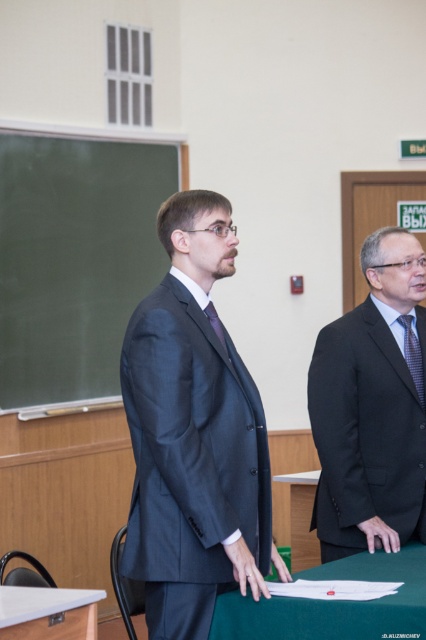
You are standing in the classroom and need to locate the dark gray suit at right. What are the coordinates of its position?

The dark gray suit at right is located at coordinates (371,406).

You are a photographer standing in the classroom and want to take a photo of both the dark gray suit at right and the green fabric table at center. Which object should you focus on first to ensure it appears sharp in the photo?

You should focus on the dark gray suit at right first because it is closer to you than the green fabric table at center, so focusing on it will keep it sharp while the table may appear slightly blurred. Alternatively, adjust your camera settings to ensure both are in focus.